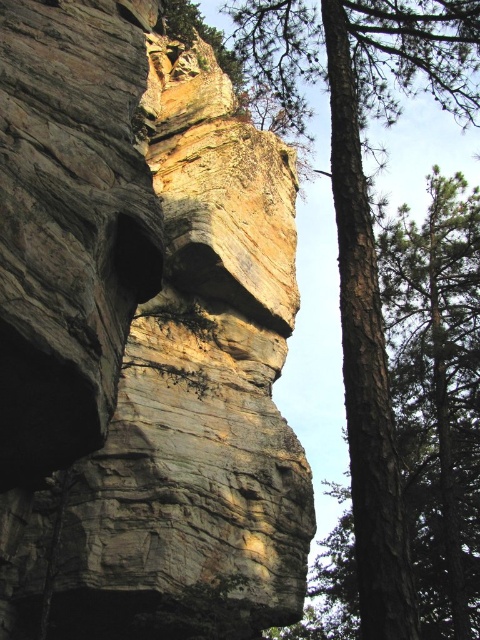
Question: Is the position of rustic stone cliff face at center more distant than that of brown rough bark tree at right?

Choices:
 (A) no
 (B) yes

Answer: (B)

Question: In this image, where is rustic stone cliff face at center located relative to brown rough bark tree at right?

Choices:
 (A) above
 (B) below

Answer: (B)

Question: Does rustic stone cliff face at center have a smaller size compared to brown rough bark tree at right?

Choices:
 (A) no
 (B) yes

Answer: (B)

Question: Which of the following is the closest to the observer?

Choices:
 (A) rustic stone cliff face at center
 (B) brown rough bark tree at right

Answer: (B)

Question: Which point appears farthest from the camera in this image?

Choices:
 (A) coord(106,481)
 (B) coord(311,74)

Answer: (B)